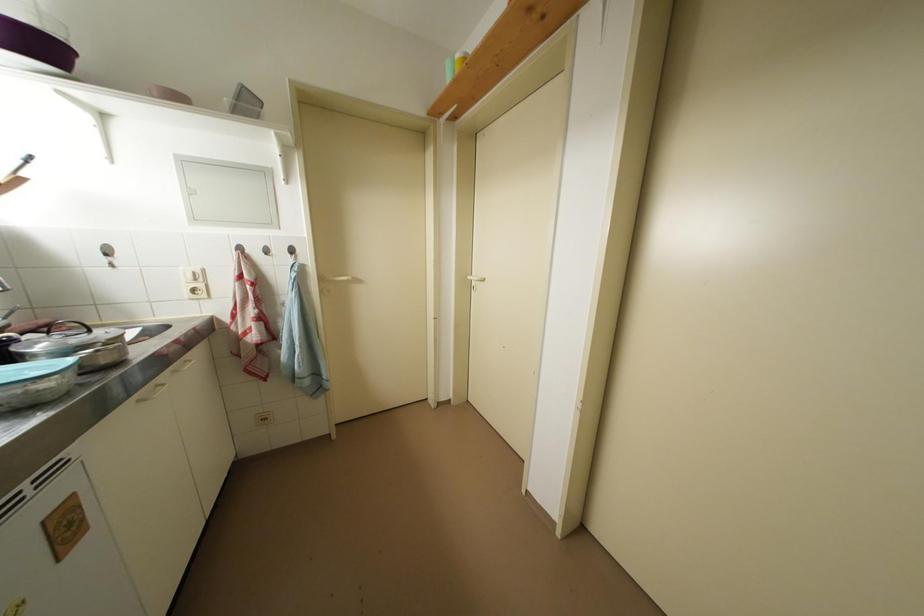
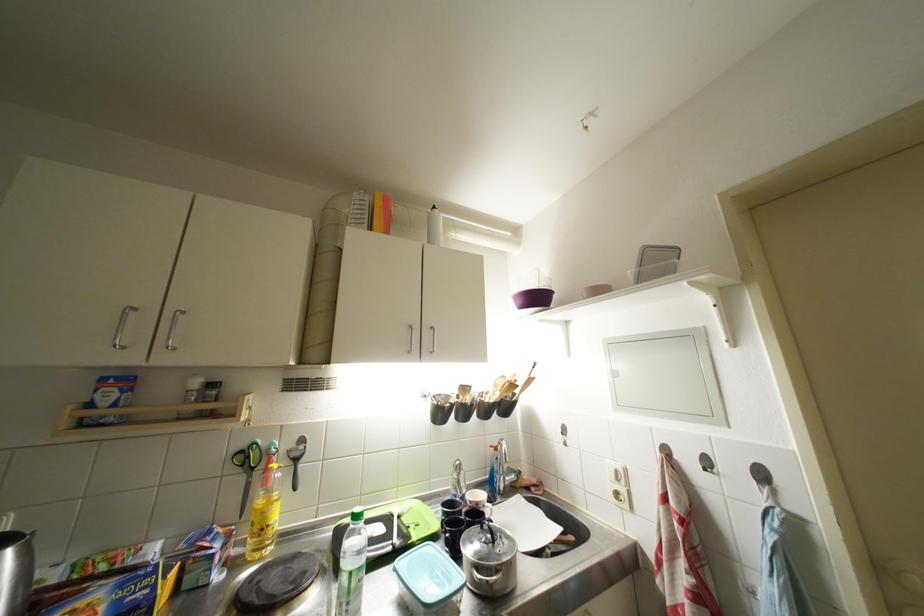
In the second image, find the point that corresponds to point 96,334 in the first image.

(500, 546)